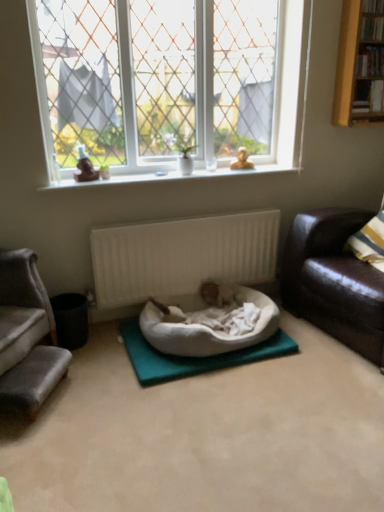
The image size is (384, 512). In order to click on vacant region in front of black matte trash bin at lower left in this screenshot , I will do `click(87, 360)`.